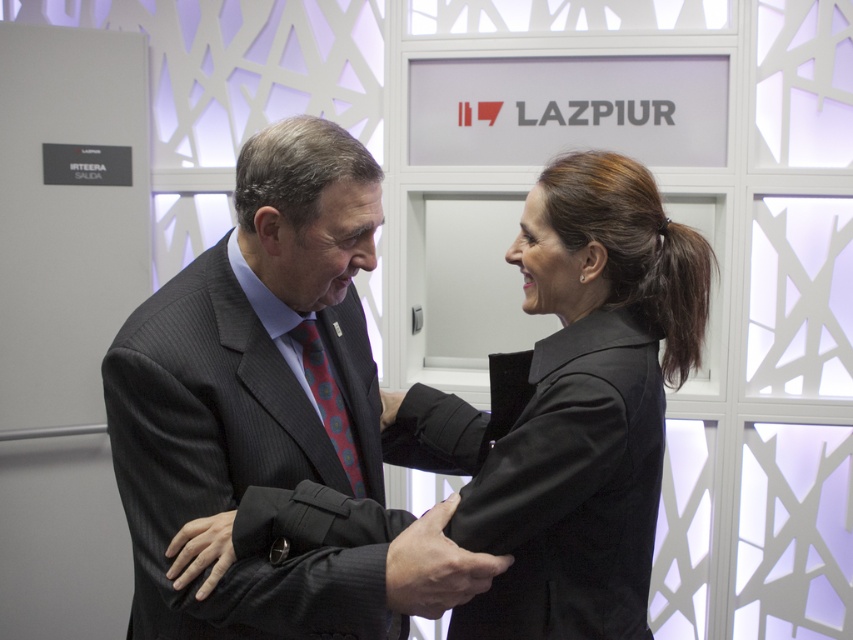
Is the position of black matte jacket at center less distant than that of polka dot silk tie at center?

Yes.

This screenshot has height=640, width=853. What do you see at coordinates (585, 406) in the screenshot?
I see `black matte jacket at center` at bounding box center [585, 406].

I want to click on black matte jacket at center, so click(585, 406).

In the scene shown: Does dark gray suit at center have a greater height compared to black matte jacket at center?

Yes.

Is dark gray suit at center below black matte jacket at center?

Yes, dark gray suit at center is below black matte jacket at center.

At what (x,y) coordinates should I click in order to perform the action: click on dark gray suit at center. Please return your answer as a coordinate pair (x, y). Looking at the image, I should click on (258, 396).

Is dark gray suit at center smaller than polka dot silk tie at center?

Actually, dark gray suit at center might be larger than polka dot silk tie at center.

Is point (358, 589) positioned behind point (341, 406)?

No, it is not.

Who is more distant from viewer, [308,460] or [315,381]?

Positioned behind is point [315,381].

Locate an element on the screen. This screenshot has width=853, height=640. dark gray suit at center is located at coordinates click(x=258, y=396).